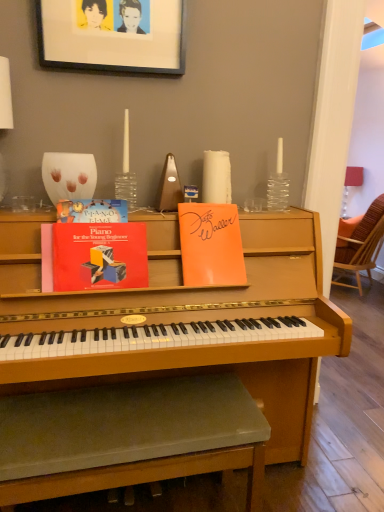
Question: In terms of height, does wooden woven chair at right look taller or shorter compared to orange paper at upper center, the first paperback book when ordered from right to left?

Choices:
 (A) short
 (B) tall

Answer: (B)

Question: Considering the relative positions of wooden woven chair at right and orange paper at upper center, the 3th paperback book when ordered from left to right, in the image provided, is wooden woven chair at right to the left or to the right of orange paper at upper center, the 3th paperback book when ordered from left to right,?

Choices:
 (A) right
 (B) left

Answer: (A)

Question: Which object is positioned closest to the orange paper at upper center, the first paperback book when ordered from right to left?

Choices:
 (A) wooden woven chair at right
 (B) black matte picture frame at upper center
 (C) matte red book at center, arranged as the 2th paperback book when viewed from the right
 (D) green fabric music stool at lower center
 (E) hardcover book at upper left, which is counted as the third paperback book, starting from the right

Answer: (C)

Question: Based on their relative distances, which object is nearer to the wooden woven chair at right?

Choices:
 (A) matte red book at center, the 2th paperback book from the left
 (B) orange paper at upper center, the first paperback book when ordered from right to left
 (C) hardcover book at upper left, acting as the 1th paperback book starting from the left
 (D) green fabric music stool at lower center
 (E) black matte picture frame at upper center

Answer: (B)